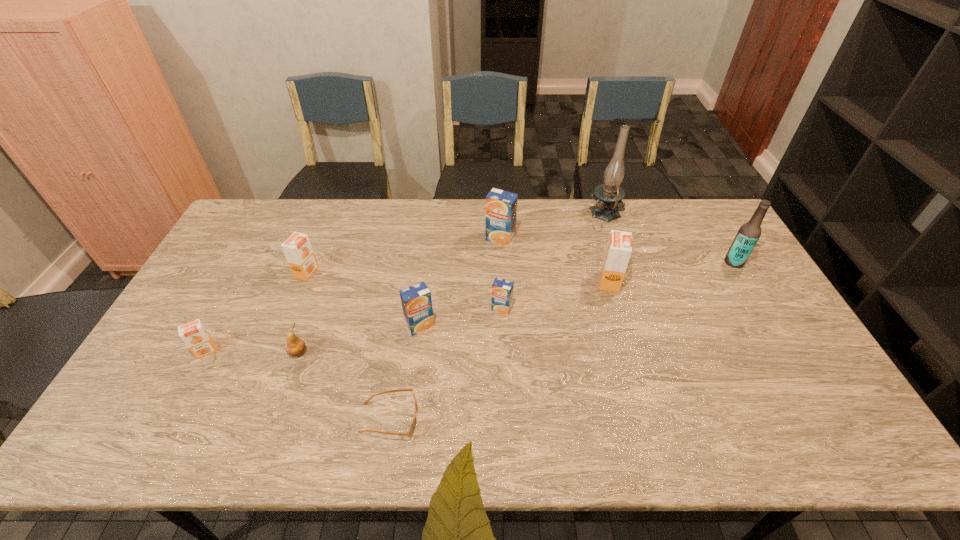
Where is `empty location between the leftmost orange juice and the oil lamp`? empty location between the leftmost orange juice and the oil lamp is located at coordinates 406,283.

The width and height of the screenshot is (960, 540). I want to click on object that is the fourth closest to the sunglasses, so click(x=194, y=334).

Locate an element on the screen. the ninth closest object to the sunglasses is located at coordinates (749, 233).

This screenshot has width=960, height=540. What are the coordinates of `orange juice that is the fourth closest to the biggest orange orange juice` in the screenshot? It's located at (298, 251).

Locate an element on the screen. The image size is (960, 540). orange juice that is the second closest one to the tallest object is located at coordinates (501, 206).

Identify the location of the third closest blue orange_juice relative to the rightmost object. The width and height of the screenshot is (960, 540). (416, 301).

The height and width of the screenshot is (540, 960). In order to click on the closest blue orange_juice relative to the second smallest blue orange_juice in this screenshot , I will do `click(502, 290)`.

Identify which orange orange juice is the second nearest to the eighth object from right to left. Please provide its 2D coordinates. Your answer should be formatted as a tuple, i.e. [(x, y)], where the tuple contains the x and y coordinates of a point satisfying the conditions above.

[(298, 251)]

I want to click on the closest orange orange juice to the second orange orange juice from left to right, so click(194, 334).